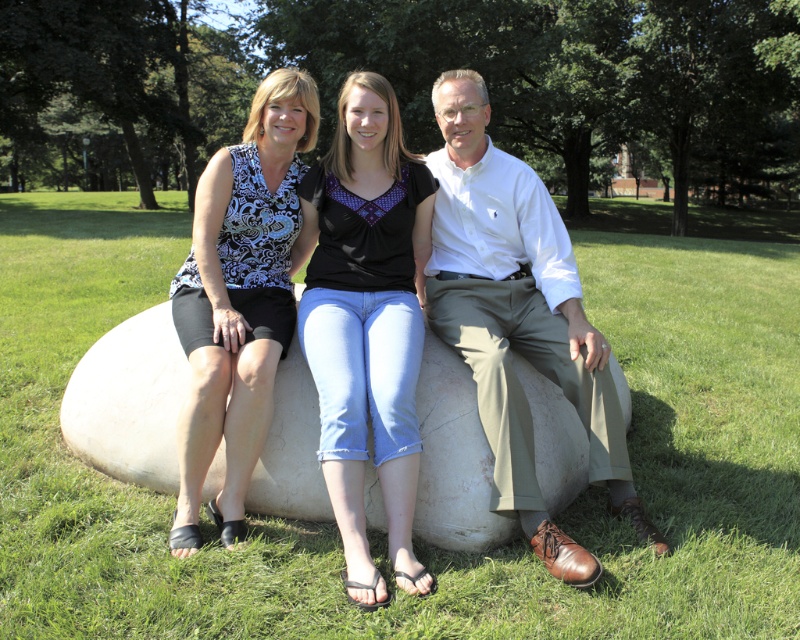
Question: Which object is the farthest from the white smooth boulder at center?

Choices:
 (A) green grass at center
 (B) light brown leather pants at center
 (C) denim jeans at center
 (D) matte white stone at center

Answer: (A)

Question: Which object is positioned farthest from the green grass at center?

Choices:
 (A) matte black tank top at left
 (B) matte white stone at center
 (C) light brown leather pants at center
 (D) white smooth boulder at center

Answer: (A)

Question: Can you confirm if green grass at center is bigger than light brown leather pants at center?

Choices:
 (A) yes
 (B) no

Answer: (A)

Question: Where is denim jeans at center located in relation to matte black tank top at left in the image?

Choices:
 (A) below
 (B) above

Answer: (A)

Question: Can you confirm if green grass at center is wider than light brown leather pants at center?

Choices:
 (A) yes
 (B) no

Answer: (A)

Question: Which object appears closest to the camera in this image?

Choices:
 (A) matte white stone at center
 (B) matte black tank top at left
 (C) white smooth boulder at center

Answer: (A)